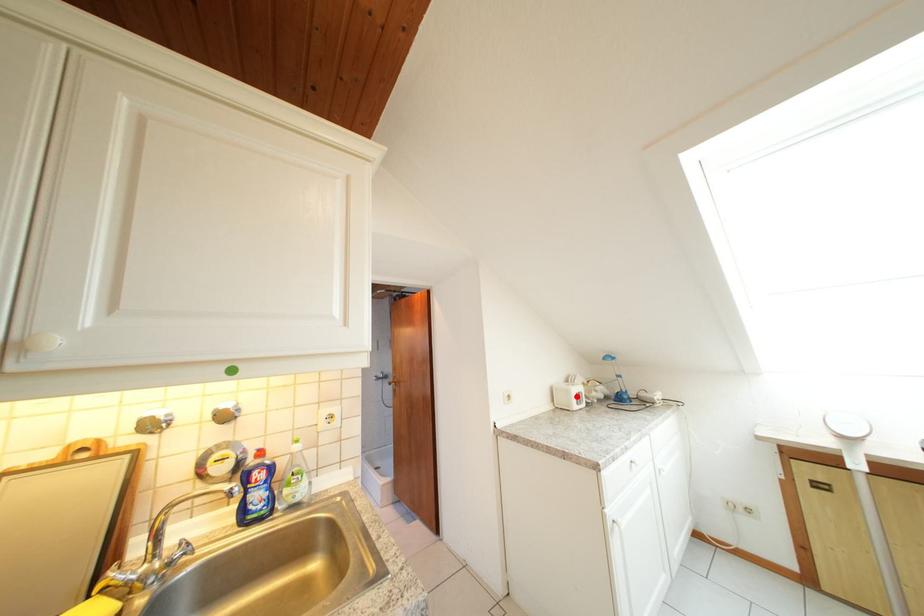
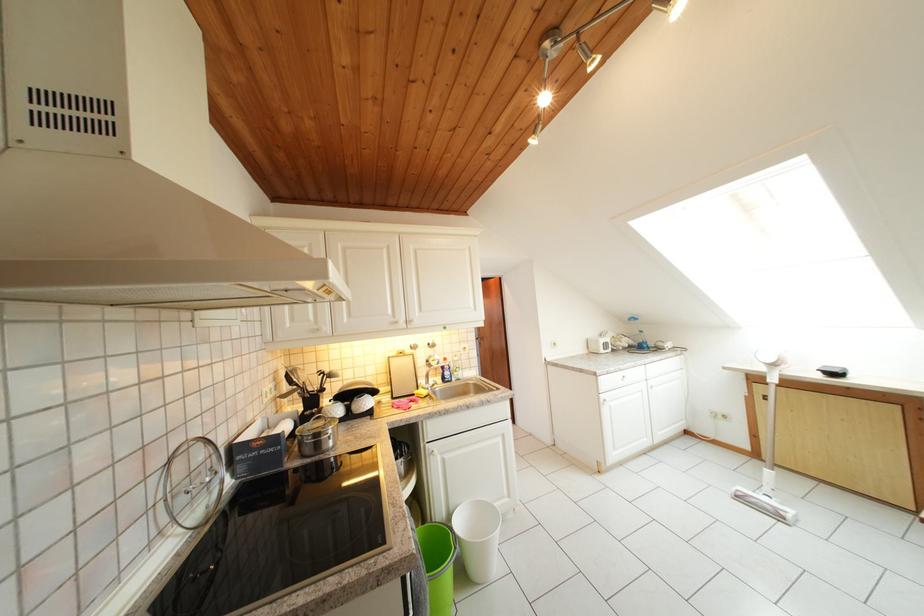
Question: I am providing you with two images of the same scene from different viewpoints. In image1, a red point is highlighted. Considering the same 3D point in image2, which of the following is correct?

Choices:
 (A) It is closer
 (B) It is farther

Answer: (A)